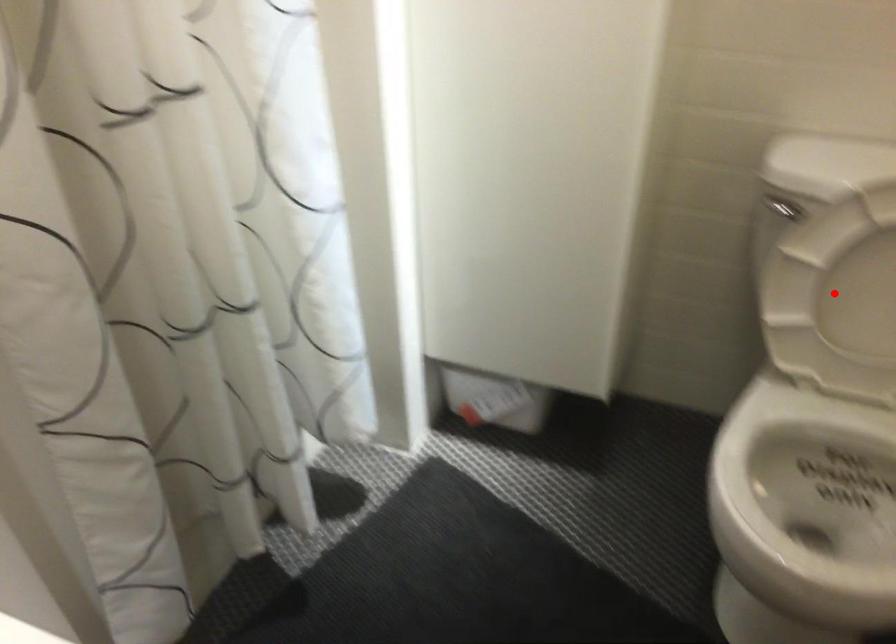
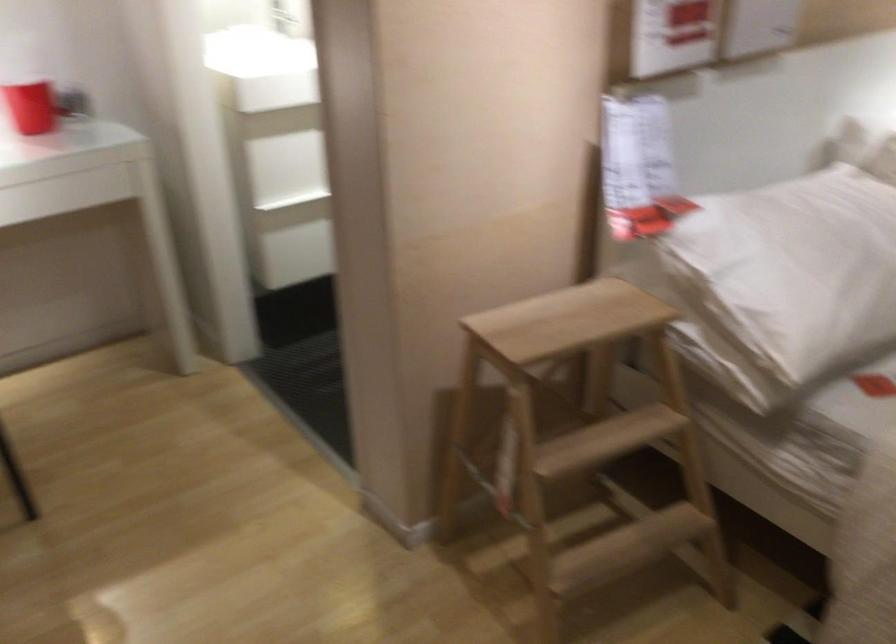
Question: I am providing you with two images of the same scene from different viewpoints. A red point is marked on the first image. Is the red point's position out of view in image 2?

Choices:
 (A) Yes
 (B) No

Answer: (A)